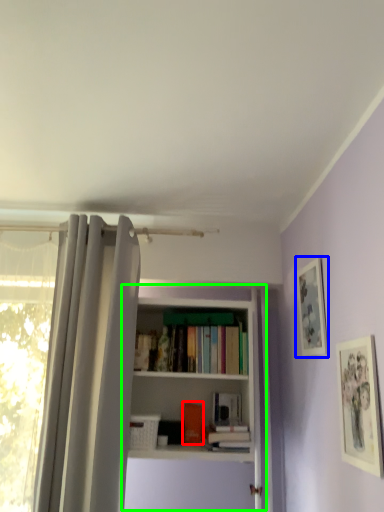
Question: Based on their relative distances, which object is farther from book (highlighted by a red box)? Choose from picture frame (highlighted by a blue box) and bookcase (highlighted by a green box).

Choices:
 (A) picture frame
 (B) bookcase

Answer: (A)